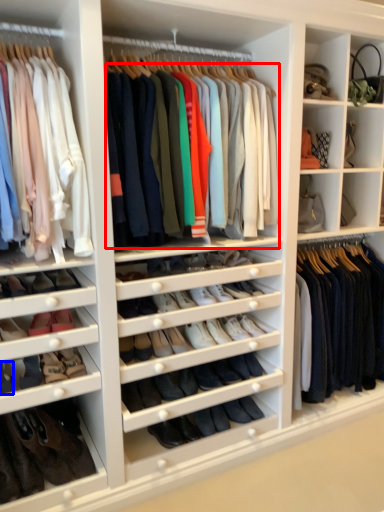
Question: Which object is further to the camera taking this photo, clothing (highlighted by a red box) or shoe (highlighted by a blue box)?

Choices:
 (A) clothing
 (B) shoe

Answer: (B)